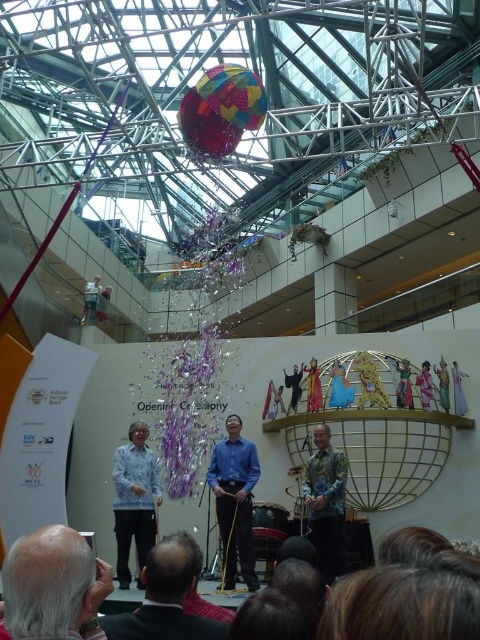
Based on the photo, can you confirm if dark gray suit at lower center is shorter than floral-patterned shirt at center?

Yes, dark gray suit at lower center is shorter than floral-patterned shirt at center.

Can you confirm if dark gray suit at lower center is positioned above floral-patterned shirt at center?

No, dark gray suit at lower center is not above floral-patterned shirt at center.

Is point (118, 636) positioned after point (319, 520)?

That is False.

This screenshot has height=640, width=480. What are the coordinates of `dark gray suit at lower center` in the screenshot? It's located at (167, 596).

Is dark gray suit at lower center smaller than blue shirt at center?

Correct, dark gray suit at lower center occupies less space than blue shirt at center.

From the picture: Is dark gray suit at lower center shorter than blue shirt at center?

Yes, dark gray suit at lower center is shorter than blue shirt at center.

Locate an element on the screen. This screenshot has height=640, width=480. dark gray suit at lower center is located at coordinates (167, 596).

Is point (255, 456) closer to viewer compared to point (301, 484)?

No.

Between point (222, 508) and point (311, 474), which one is positioned behind?

Point (311, 474)

What are the coordinates of `blue shirt at center` in the screenshot? It's located at (235, 500).